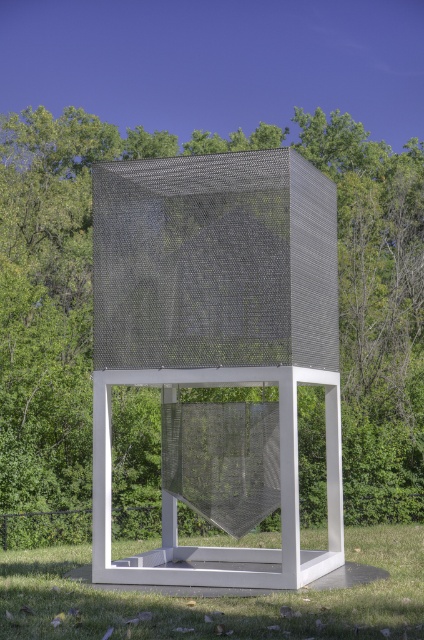
Can you confirm if metal mesh cube at center is positioned below green grass at lower center?

No.

Can you confirm if metal mesh cube at center is taller than green grass at lower center?

Yes, metal mesh cube at center is taller than green grass at lower center.

Between point (250, 572) and point (254, 596), which one is positioned behind?

Positioned behind is point (250, 572).

The height and width of the screenshot is (640, 424). I want to click on metal mesh cube at center, so click(217, 330).